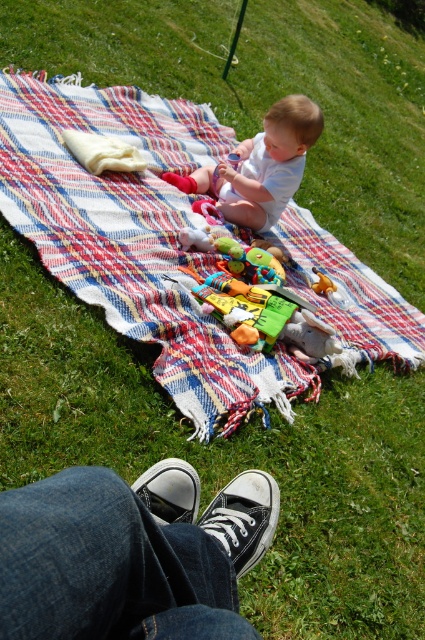
You are a photographer trying to capture the baby and the toys on the blanket. Since the plaid fabric blanket at center and the rubberized plastic toy at center are in the frame, which object will appear larger in your photo?

The plaid fabric blanket at center will appear larger in the photo since it is taller than the rubberized plastic toy at center.

You are a photographer aiming to capture a closeup of the plaid fabric blanket at center without including the white canvas shoes at lower center in the shot. Based on their positions, is this possible?

The plaid fabric blanket at center is located above the white canvas shoes at lower center, so it is possible to capture a closeup of the plaid fabric blanket at center without including the white canvas shoes at lower center by focusing on the upper part of the scene.